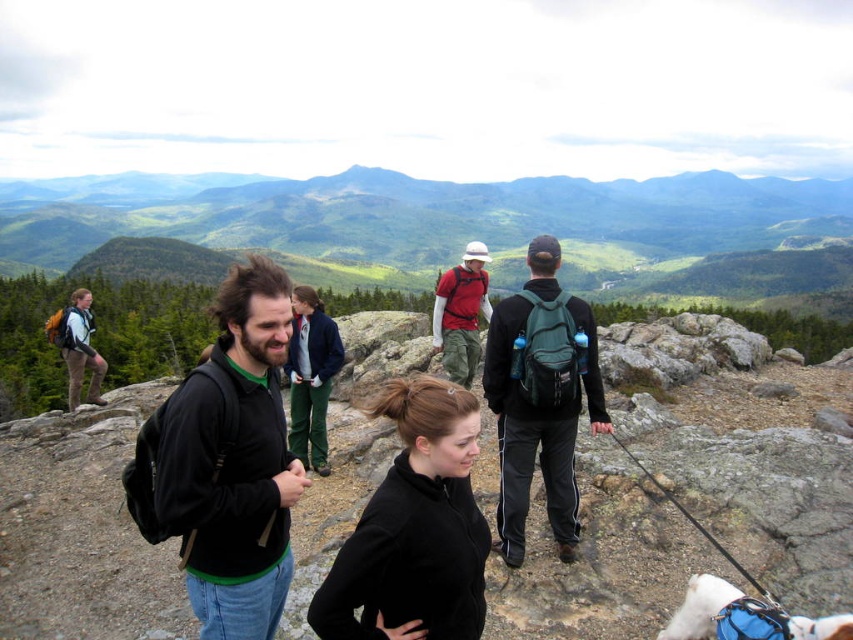
Question: Which point is farther from the camera taking this photo?

Choices:
 (A) (514, 492)
 (B) (231, 182)

Answer: (B)

Question: Considering the relative positions of black matte jacket at center and black matte sweater at center in the image provided, where is black matte jacket at center located with respect to black matte sweater at center?

Choices:
 (A) below
 (B) above

Answer: (B)

Question: Does black matte jacket at center appear on the right side of black matte sweater at center?

Choices:
 (A) yes
 (B) no

Answer: (B)

Question: Which point is farther to the camera?

Choices:
 (A) green matte backpack at center-right
 (B) black matte jacket at center

Answer: (A)

Question: Where is green grassy mountain at upper center located in relation to green matte backpack at center-right in the image?

Choices:
 (A) above
 (B) below

Answer: (A)

Question: Among these objects, which one is nearest to the camera?

Choices:
 (A) black matte jacket at center
 (B) black matte sweater at center

Answer: (B)